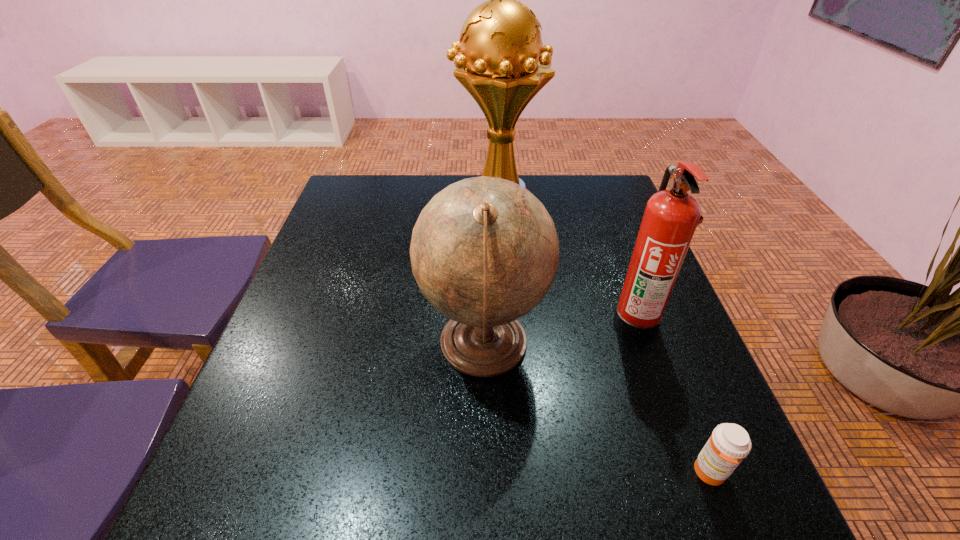
Locate an element on the screen. This screenshot has width=960, height=540. free spot between the fire extinguisher and the globe is located at coordinates (560, 334).

Locate an element on the screen. This screenshot has width=960, height=540. vacant point located between the fire extinguisher and the globe is located at coordinates (560, 334).

You are a GUI agent. You are given a task and a screenshot of the screen. Output one action in this format:
    pyautogui.click(x=<x>, y=<y>)
    Task: Click on the empty space between the shortest object and the globe
    
    Given the screenshot: What is the action you would take?
    pyautogui.click(x=597, y=409)

Identify the location of unoccupied position between the nearest object and the globe. The height and width of the screenshot is (540, 960). (597, 409).

At what (x,y) coordinates should I click in order to perform the action: click on vacant area that lies between the shortest object and the globe. Please return your answer as a coordinate pair (x, y). This screenshot has height=540, width=960. Looking at the image, I should click on (597, 409).

Find the location of a particular element. This screenshot has height=540, width=960. unoccupied area between the fire extinguisher and the globe is located at coordinates (560, 334).

Identify which object is the third nearest to the globe. Please provide its 2D coordinates. Your answer should be formatted as a tuple, i.e. [(x, y)], where the tuple contains the x and y coordinates of a point satisfying the conditions above.

[(503, 64)]

In order to click on object that stands as the third closest to the trophy_cup in this screenshot , I will do `click(729, 444)`.

You are a GUI agent. You are given a task and a screenshot of the screen. Output one action in this format:
    pyautogui.click(x=<x>, y=<y>)
    Task: Click on the free space that satisfies the following two spatial constraints: 1. on the front-facing side of the globe; 2. on the left side of the medicine
    
    Given the screenshot: What is the action you would take?
    pyautogui.click(x=485, y=473)

Where is `blank area in the image that satisfies the following two spatial constraints: 1. on the back side of the shortest object; 2. on the front-facing side of the globe`? The height and width of the screenshot is (540, 960). blank area in the image that satisfies the following two spatial constraints: 1. on the back side of the shortest object; 2. on the front-facing side of the globe is located at coordinates (661, 346).